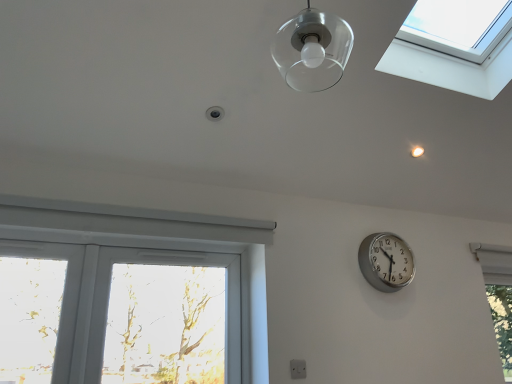
Question: From the image's perspective, is transparent glass window at upper right, which is the 2th window in bottom-to-top order, on transparent glass droplight at upper center?

Choices:
 (A) no
 (B) yes

Answer: (B)

Question: Is the depth of transparent glass window at upper right, which is counted as the 1th window, starting from the top, less than that of transparent glass droplight at upper center?

Choices:
 (A) yes
 (B) no

Answer: (A)

Question: From a real-world perspective, is transparent glass window at upper right, the first window when ordered from front to back, below transparent glass droplight at upper center?

Choices:
 (A) yes
 (B) no

Answer: (B)

Question: Considering the relative sizes of transparent glass window at upper right, placed as the second window when sorted from back to front, and transparent glass droplight at upper center in the image provided, is transparent glass window at upper right, placed as the second window when sorted from back to front, thinner than transparent glass droplight at upper center?

Choices:
 (A) yes
 (B) no

Answer: (B)

Question: Is transparent glass window at upper right, which is counted as the 1th window, starting from the top, at the left side of transparent glass droplight at upper center?

Choices:
 (A) no
 (B) yes

Answer: (A)

Question: Based on their sizes in the image, would you say transparent glass window at upper right, the 1th window positioned from the left, is bigger or smaller than transparent glass droplight at upper center?

Choices:
 (A) small
 (B) big

Answer: (B)

Question: Is transparent glass window at upper right, which is counted as the 1th window, starting from the top, situated inside transparent glass droplight at upper center or outside?

Choices:
 (A) inside
 (B) outside

Answer: (B)

Question: From the image's perspective, is transparent glass window at upper right, the 1th window positioned from the left, located above or below transparent glass droplight at upper center?

Choices:
 (A) above
 (B) below

Answer: (A)

Question: Relative to transparent glass droplight at upper center, is transparent glass window at upper right, which is the 2th window in bottom-to-top order, in front or behind?

Choices:
 (A) front
 (B) behind

Answer: (A)

Question: Considering the positions of white plastic window at lower left and white plastic electric outlet at lower center in the image, is white plastic window at lower left wider or thinner than white plastic electric outlet at lower center?

Choices:
 (A) wide
 (B) thin

Answer: (A)

Question: Would you say white plastic window at lower left is to the left or to the right of white plastic electric outlet at lower center in the picture?

Choices:
 (A) left
 (B) right

Answer: (A)

Question: Is point (214, 367) closer or farther from the camera than point (292, 365)?

Choices:
 (A) farther
 (B) closer

Answer: (A)

Question: From a real-world perspective, is white plastic window at lower left physically located above or below white plastic electric outlet at lower center?

Choices:
 (A) below
 (B) above

Answer: (B)

Question: From a real-world perspective, relative to white plastic electric outlet at lower center, is transparent glass droplight at upper center vertically above or below?

Choices:
 (A) above
 (B) below

Answer: (A)

Question: From their relative heights in the image, would you say transparent glass droplight at upper center is taller or shorter than white plastic electric outlet at lower center?

Choices:
 (A) short
 (B) tall

Answer: (A)